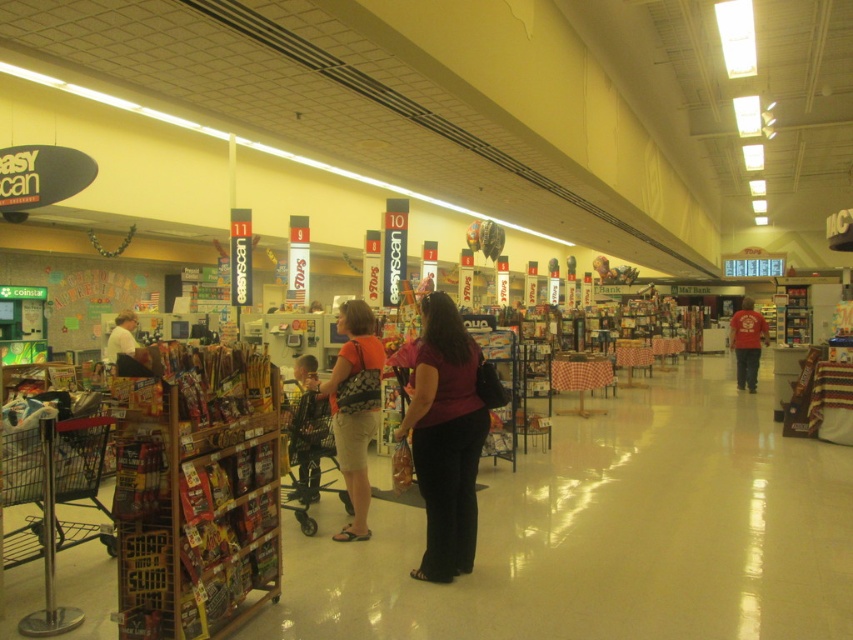
Question: Is the position of silver metallic shopping cart at lower left more distant than that of orange fabric purse at center?

Choices:
 (A) yes
 (B) no

Answer: (B)

Question: Is maroon fabric shirt at center in front of red cotton shirt at right?

Choices:
 (A) no
 (B) yes

Answer: (B)

Question: Can you confirm if silver metallic shopping cart at lower left is positioned below red cotton shirt at right?

Choices:
 (A) yes
 (B) no

Answer: (A)

Question: Estimate the real-world distances between objects in this image. Which object is closer to the maroon fabric shirt at center?

Choices:
 (A) orange fabric purse at center
 (B) metallic gray shopping cart at center

Answer: (A)

Question: Which object is closer to the camera taking this photo?

Choices:
 (A) maroon fabric shirt at center
 (B) silver metallic shopping cart at lower left
 (C) red cotton shirt at right

Answer: (B)

Question: Which object is the closest to the orange fabric purse at center?

Choices:
 (A) metallic gray shopping cart at center
 (B) silver metallic shopping cart at lower left
 (C) maroon fabric shirt at center

Answer: (A)